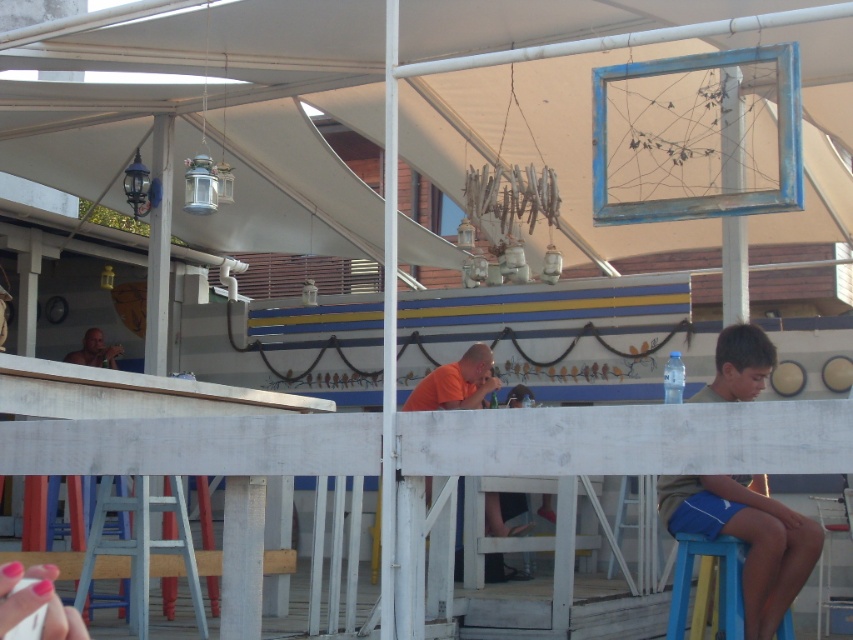
Question: Does light brown shorts at right have a lesser width compared to blue plastic stool at lower right?

Choices:
 (A) yes
 (B) no

Answer: (B)

Question: Is light brown shorts at right wider than orange matte shirt at center?

Choices:
 (A) no
 (B) yes

Answer: (B)

Question: Which point is closer to the camera taking this photo?

Choices:
 (A) (679, 554)
 (B) (469, 374)

Answer: (A)

Question: Which object is farther from the camera taking this photo?

Choices:
 (A) light brown shorts at right
 (B) blue plastic stool at lower right
 (C) orange matte shirt at center
 (D) shiny orange shirt at upper left

Answer: (D)

Question: Estimate the real-world distances between objects in this image. Which object is closer to the blue plastic stool at lower right?

Choices:
 (A) light brown shorts at right
 (B) orange matte shirt at center
 (C) shiny orange shirt at upper left

Answer: (A)

Question: Is light brown shorts at right above shiny orange shirt at upper left?

Choices:
 (A) no
 (B) yes

Answer: (A)